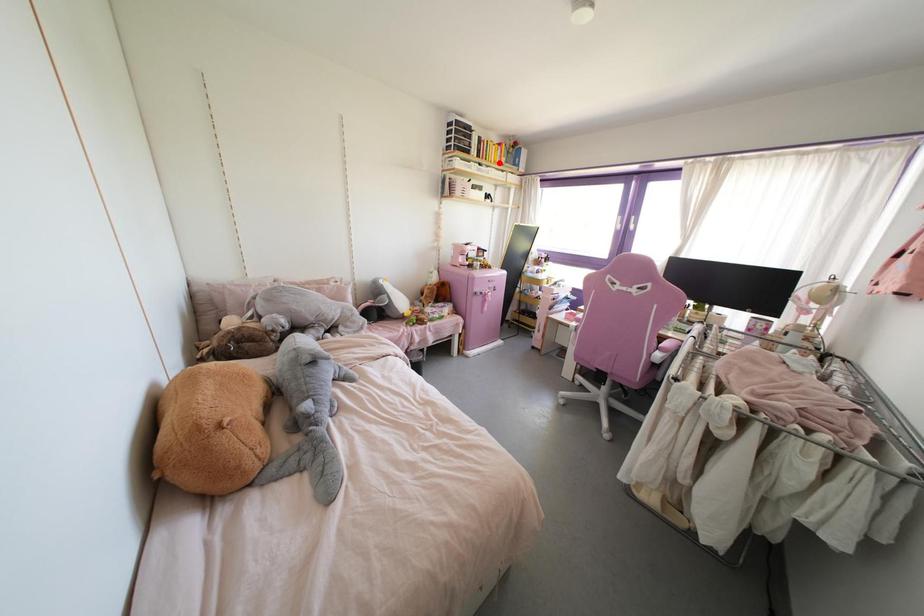
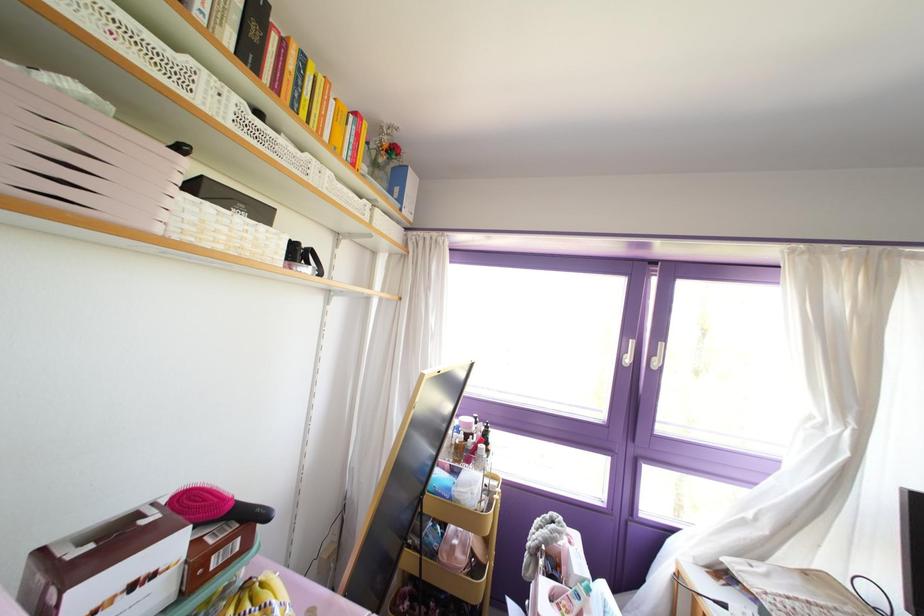
Find the pixel in the second image that matches the highlighted location in the first image.

(351, 164)